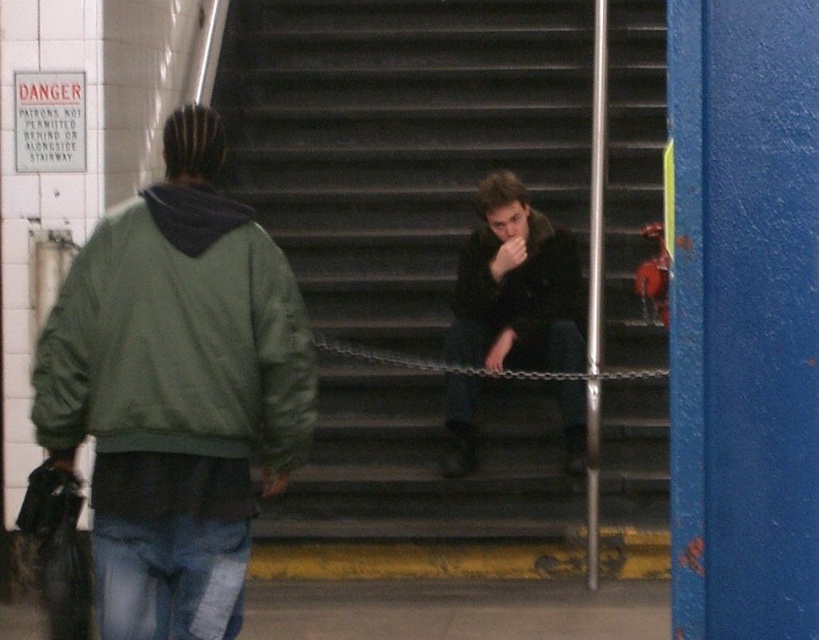
Question: Which point appears farthest from the camera in this image?

Choices:
 (A) (297, 339)
 (B) (381, 563)
 (C) (462, 296)
 (D) (534, 240)

Answer: (D)

Question: Is dark gray concrete stairs at center in front of green matte jacket at left?

Choices:
 (A) no
 (B) yes

Answer: (A)

Question: Which of these objects is positioned farthest from the green matte jacket at left?

Choices:
 (A) black matte jacket at center
 (B) dark gray concrete stairs at center

Answer: (B)

Question: Can you confirm if green matte jacket at left is smaller than dark brown leather jacket at center?

Choices:
 (A) no
 (B) yes

Answer: (A)

Question: Based on their relative distances, which object is nearer to the dark gray concrete stairs at center?

Choices:
 (A) black matte jacket at center
 (B) metallic chain at center
 (C) dark brown leather jacket at center
 (D) green matte jacket at left

Answer: (A)

Question: Can you confirm if dark brown leather jacket at center is positioned to the left of metallic chain at center?

Choices:
 (A) no
 (B) yes

Answer: (A)